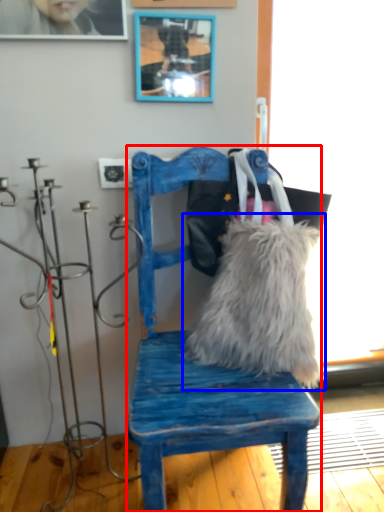
Question: Among these objects, which one is nearest to the camera, chair (highlighted by a red box) or pillow (highlighted by a blue box)?

Choices:
 (A) chair
 (B) pillow

Answer: (A)